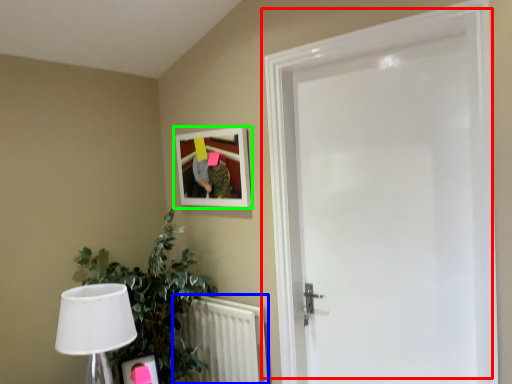
Question: Estimate the real-world distances between objects in this image. Which object is farther from door (highlighted by a red box), radiator (highlighted by a blue box) or picture frame (highlighted by a green box)?

Choices:
 (A) radiator
 (B) picture frame

Answer: (A)